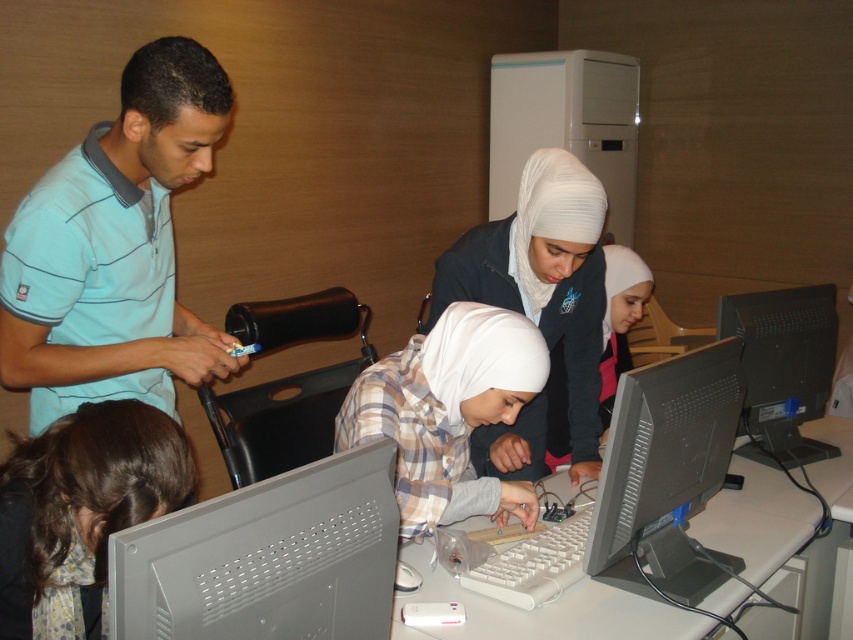
Question: Which point is farther from the camera taking this photo?

Choices:
 (A) (706, 381)
 (B) (416, 506)
 (C) (759, 300)
 (D) (138, 182)

Answer: (C)

Question: Can you confirm if white matte hijab at center is bigger than gray plastic monitor at right?

Choices:
 (A) no
 (B) yes

Answer: (B)

Question: Observing the image, what is the correct spatial positioning of gray plastic monitor at right in reference to dark brown hair at lower left?

Choices:
 (A) below
 (B) above

Answer: (B)

Question: Which point is farther from the camera taking this photo?

Choices:
 (A) (622, 554)
 (B) (167, 301)
 (C) (773, 410)
 (D) (50, 444)

Answer: (C)

Question: Which of the following is the closest to the observer?

Choices:
 (A) (791, 340)
 (B) (144, 506)
 (C) (479, 499)
 (D) (125, 113)

Answer: (B)

Question: From the image, what is the correct spatial relationship of gray plastic monitor at right in relation to black plastic monitor at right?

Choices:
 (A) right
 (B) left

Answer: (B)